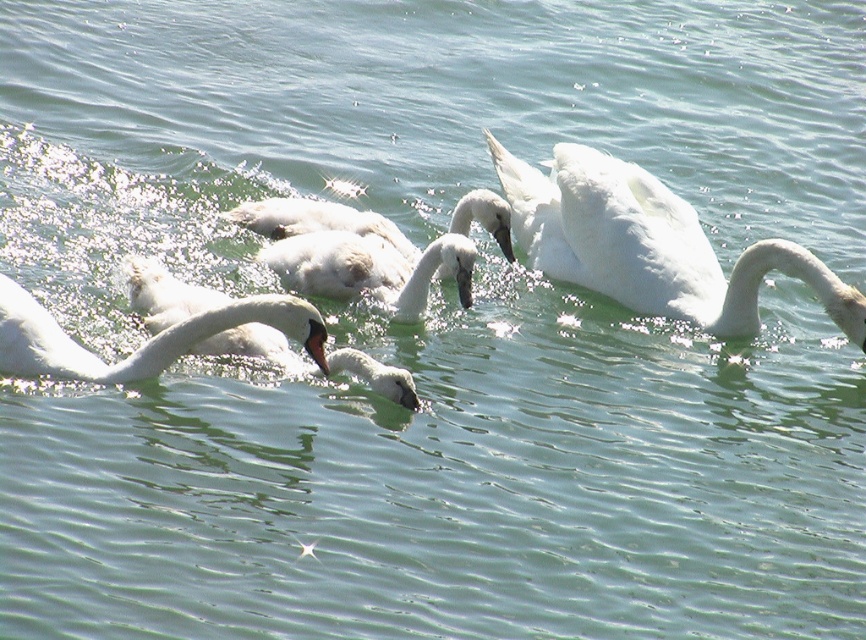
Question: Estimate the real-world distances between objects in this image. Which object is farther from the white fluffy swan at center?

Choices:
 (A) white matte duck at center
 (B) white glossy swan at upper right
 (C) white feathered swan at center

Answer: (B)

Question: Which point appears farthest from the camera in this image?

Choices:
 (A) (729, 282)
 (B) (409, 246)
 (C) (37, 372)

Answer: (B)

Question: Is white fluffy swan at center bigger than white feathered swan at center?

Choices:
 (A) yes
 (B) no

Answer: (A)

Question: Observing the image, what is the correct spatial positioning of white glossy swan at upper right in reference to white feathered swan at center?

Choices:
 (A) above
 (B) below

Answer: (B)

Question: Can you confirm if white glossy swan at upper right is positioned below white glossy swan at left?

Choices:
 (A) yes
 (B) no

Answer: (B)

Question: Which is nearer to the white glossy swan at left?

Choices:
 (A) white matte duck at center
 (B) white feathered swan at center
 (C) white fluffy swan at center

Answer: (A)